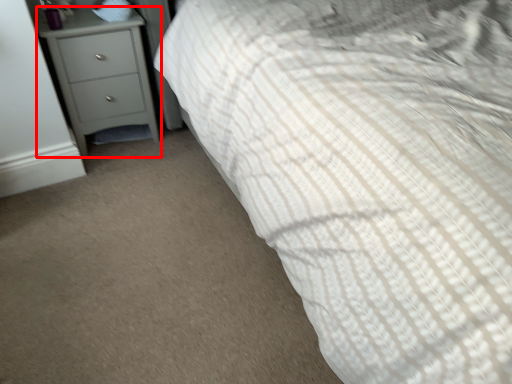
Question: Considering the relative positions of chest of drawers (annotated by the red box) and pillow in the image provided, where is chest of drawers (annotated by the red box) located with respect to the staircase?

Choices:
 (A) left
 (B) right

Answer: (A)